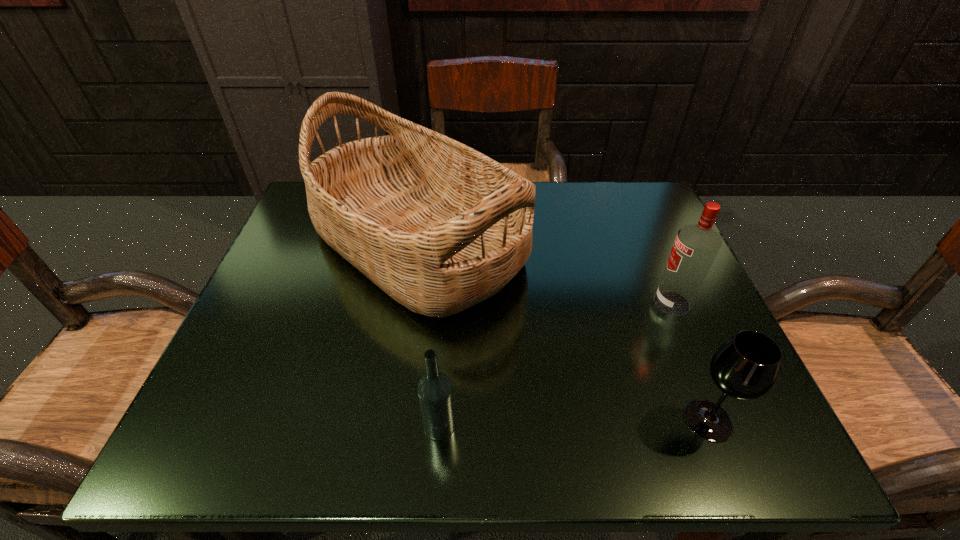
At what (x,y) coordinates should I click in order to perform the action: click on free location located on the back of the wineglass. Please return your answer as a coordinate pair (x, y). The height and width of the screenshot is (540, 960). Looking at the image, I should click on (642, 256).

At what (x,y) coordinates should I click in order to perform the action: click on vacant space located on the left of the nearer vodka. Please return your answer as a coordinate pair (x, y). This screenshot has width=960, height=540. Looking at the image, I should click on (263, 426).

The height and width of the screenshot is (540, 960). What are the coordinates of `object located in the far edge section of the desktop` in the screenshot? It's located at (438, 226).

At what (x,y) coordinates should I click in order to perform the action: click on wineglass that is at the near edge. Please return your answer as a coordinate pair (x, y). This screenshot has width=960, height=540. Looking at the image, I should click on (745, 367).

Identify the location of vodka positioned at the near edge. (435, 392).

Locate an element on the screen. object situated at the left edge is located at coordinates (438, 226).

Where is `vodka situated at the right edge`? Image resolution: width=960 pixels, height=540 pixels. vodka situated at the right edge is located at coordinates (696, 245).

The image size is (960, 540). Find the location of `wineglass situated at the right edge`. wineglass situated at the right edge is located at coordinates (745, 367).

Where is `object located at the far left corner`? This screenshot has width=960, height=540. object located at the far left corner is located at coordinates point(438,226).

In order to click on object situated at the near right corner in this screenshot , I will do `click(745, 367)`.